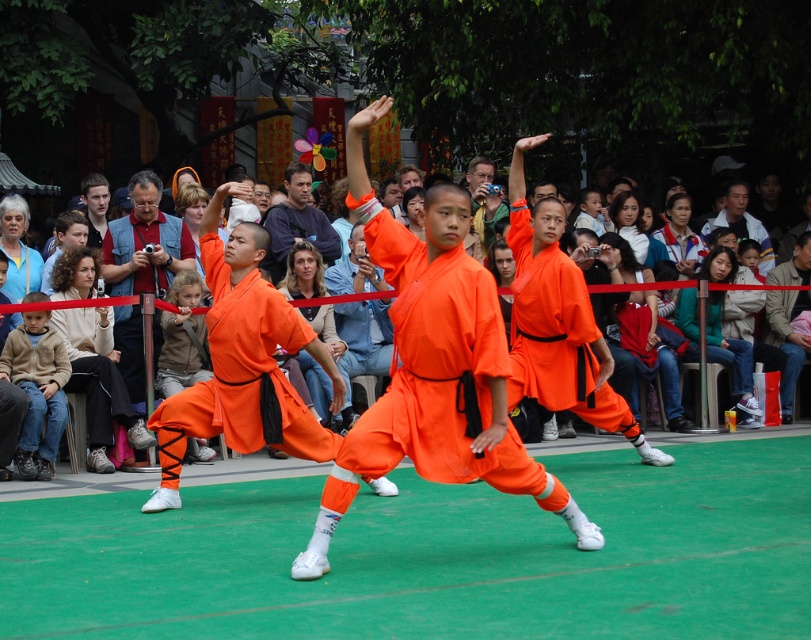
From the picture: Is light brown leather jacket at center smaller than matte orange robe at center?

No.

Is light brown leather jacket at center taller than matte orange robe at center?

Yes, light brown leather jacket at center is taller than matte orange robe at center.

Locate an element on the screen. The height and width of the screenshot is (640, 811). light brown leather jacket at center is located at coordinates (97, 381).

Consider the image. Can you confirm if brown fleece jacket at lower left is taller than matte orange robe at center?

Correct, brown fleece jacket at lower left is much taller as matte orange robe at center.

Between point (3, 349) and point (681, 241), which one is positioned behind?

The point (681, 241) is more distant.

The image size is (811, 640). I want to click on brown fleece jacket at lower left, so click(37, 390).

Can you confirm if brown fleece jacket at lower left is smaller than orange cotton pants at center?

Yes, brown fleece jacket at lower left is smaller than orange cotton pants at center.

The height and width of the screenshot is (640, 811). Describe the element at coordinates (37, 390) in the screenshot. I see `brown fleece jacket at lower left` at that location.

Locate an element on the screen. Image resolution: width=811 pixels, height=640 pixels. brown fleece jacket at lower left is located at coordinates (37, 390).